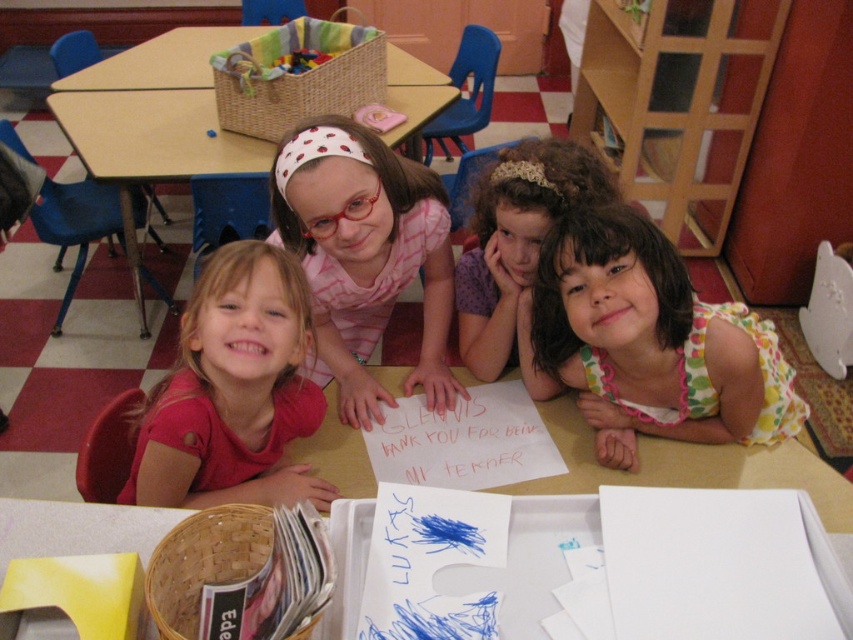
How much distance is there between floral dress at center and wooden table at center?

They are 1.71 meters apart.

The height and width of the screenshot is (640, 853). I want to click on floral dress at center, so click(650, 340).

Describe the element at coordinates (650, 340) in the screenshot. The height and width of the screenshot is (640, 853). I see `floral dress at center` at that location.

Identify the location of floral dress at center. (650, 340).

Is floral dress at center in front of curly-haired girl at center?

Yes, floral dress at center is closer to the viewer.

Which is behind, point (711, 388) or point (497, 243)?

The point (497, 243) is behind.

Between point (647, 237) and point (518, 211), which one is positioned behind?

The point (518, 211) is behind.

At what (x,y) coordinates should I click in order to perform the action: click on floral dress at center. Please return your answer as a coordinate pair (x, y). Looking at the image, I should click on (650, 340).

Between point (88, 150) and point (509, 186), which one is positioned behind?

The point (88, 150) is more distant.

Is wooden table at center positioned behind curly-haired girl at center?

Yes, wooden table at center is behind curly-haired girl at center.

Between point (131, 84) and point (498, 360), which one is positioned behind?

The point (131, 84) is behind.

Find the location of `wooden table at center`. wooden table at center is located at coordinates (154, 120).